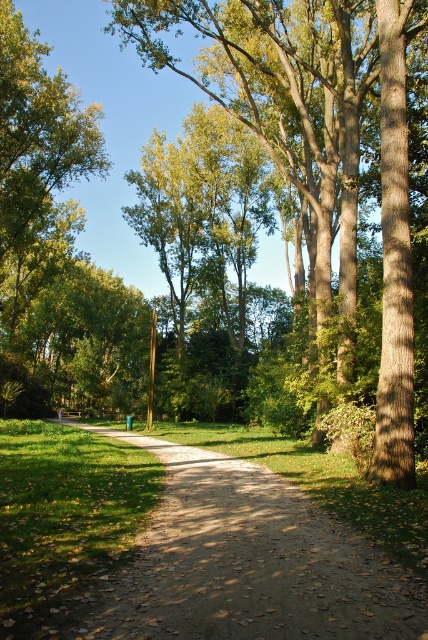
Which of these two, brown textured tree at center or dirt/gravel path at center, stands taller?

Standing taller between the two is brown textured tree at center.

Is brown textured tree at center in front of dirt/gravel path at center?

No, brown textured tree at center is further to the viewer.

Image resolution: width=428 pixels, height=640 pixels. What are the coordinates of `brown textured tree at center` in the screenshot? It's located at (317, 148).